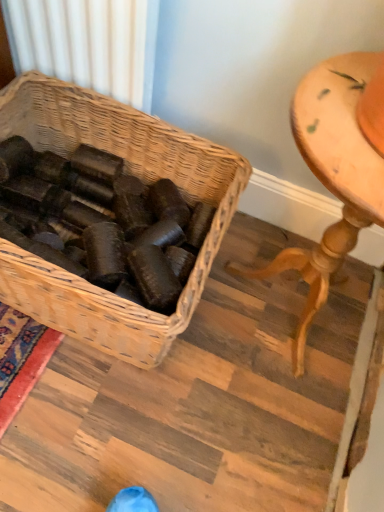
Question: From a real-world perspective, is woven brown picnic basket at center physically located above or below wooden table at right?

Choices:
 (A) below
 (B) above

Answer: (A)

Question: From their relative heights in the image, would you say woven brown picnic basket at center is taller or shorter than wooden table at right?

Choices:
 (A) short
 (B) tall

Answer: (A)

Question: Is point (49, 99) closer or farther from the camera than point (382, 224)?

Choices:
 (A) closer
 (B) farther

Answer: (B)

Question: Is wooden table at right taller or shorter than woven brown picnic basket at center?

Choices:
 (A) tall
 (B) short

Answer: (A)

Question: From the image's perspective, is wooden table at right positioned above or below woven brown picnic basket at center?

Choices:
 (A) below
 (B) above

Answer: (A)

Question: Is point 304,103 closer or farther from the camera than point 195,137?

Choices:
 (A) farther
 (B) closer

Answer: (B)

Question: Considering the positions of wooden table at right and woven brown picnic basket at center in the image, is wooden table at right bigger or smaller than woven brown picnic basket at center?

Choices:
 (A) big
 (B) small

Answer: (B)